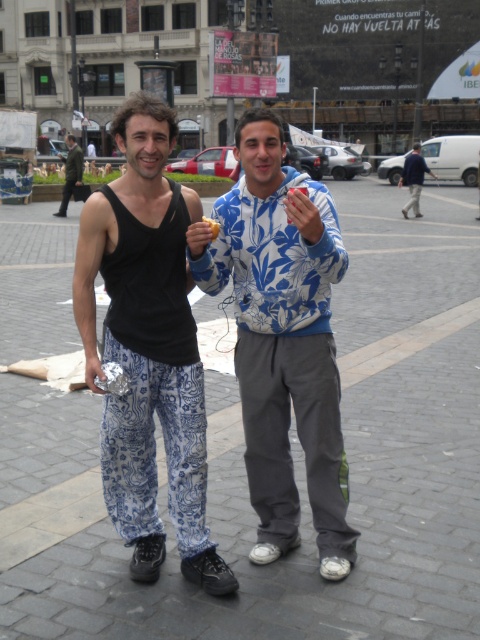
Between dark blue jacket at upper right and camouflage jacket at left, which one is positioned lower?

dark blue jacket at upper right is lower down.

Is point (411, 168) farther from viewer compared to point (74, 141)?

Yes.

Which is in front, point (416, 145) or point (61, 205)?

Point (61, 205)

Locate an element on the screen. dark blue jacket at upper right is located at coordinates (414, 179).

Who is more forward, (300, 561) or (416, 212)?

Positioned in front is point (300, 561).

Which is below, brick pavement at center or dark blue jacket at upper right?

Positioned lower is brick pavement at center.

Find the location of a particular element. The image size is (480, 640). brick pavement at center is located at coordinates (303, 468).

Between brick pavement at center and camouflage jacket at left, which one has more height?

camouflage jacket at left

Does brick pavement at center appear on the right side of camouflage jacket at left?

Yes, brick pavement at center is to the right of camouflage jacket at left.

What do you see at coordinates (303, 468) in the screenshot? I see `brick pavement at center` at bounding box center [303, 468].

This screenshot has height=640, width=480. Identify the location of brick pavement at center. (303, 468).